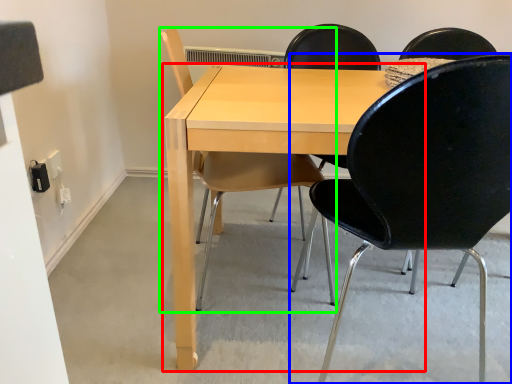
Question: Which is nearer to the table (highlighted by a red box)? chair (highlighted by a blue box) or chair (highlighted by a green box).

Choices:
 (A) chair
 (B) chair

Answer: (B)